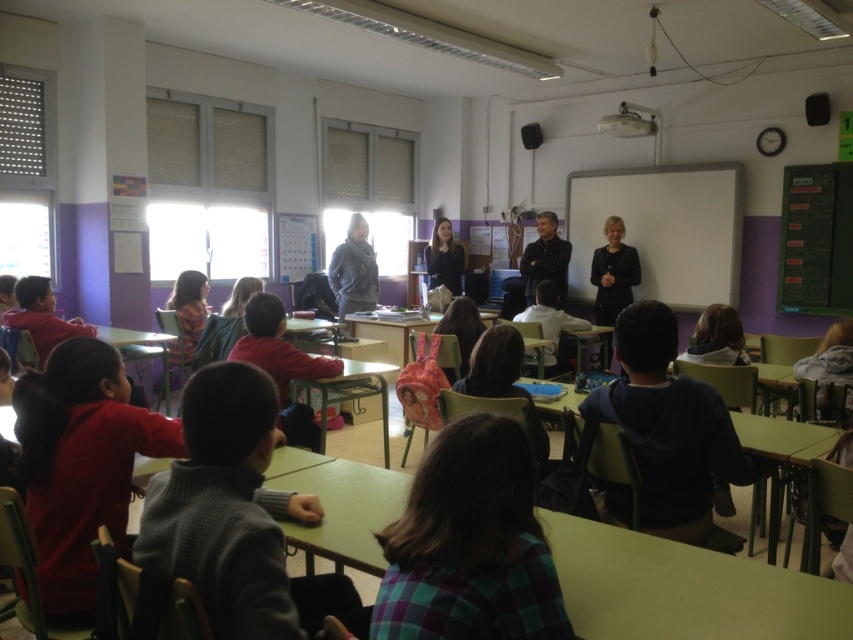
Measure the distance between black leather jacket at center and green plastic table at center.

A distance of 3.18 meters exists between black leather jacket at center and green plastic table at center.

Who is shorter, black leather jacket at center or green plastic table at center?

With less height is green plastic table at center.

Identify the location of black leather jacket at center. (613, 273).

Between point (688, 221) and point (279, 385), which one is positioned behind?

Positioned behind is point (688, 221).

In order to click on white matte/blackboard at upper center in this screenshot , I will do `click(662, 228)`.

Between point (666, 220) and point (280, 387), which one is positioned in front?

Point (280, 387)

At what (x,y) coordinates should I click in order to perform the action: click on white matte/blackboard at upper center. Please return your answer as a coordinate pair (x, y). Image resolution: width=853 pixels, height=640 pixels. Looking at the image, I should click on (662, 228).

Which is above, green matte table at center or plaid fabric shirt at center?

plaid fabric shirt at center is above.

Which is more to the left, green matte table at center or plaid fabric shirt at center?

plaid fabric shirt at center is more to the left.

The image size is (853, 640). Identify the location of green matte table at center. (683, 588).